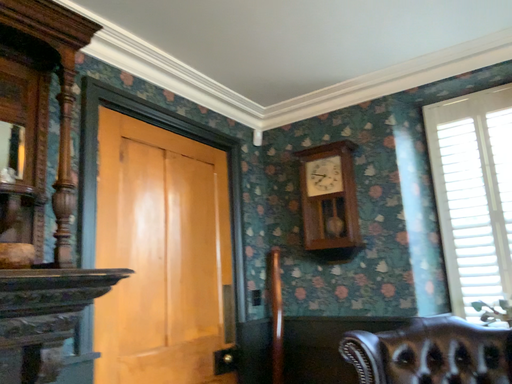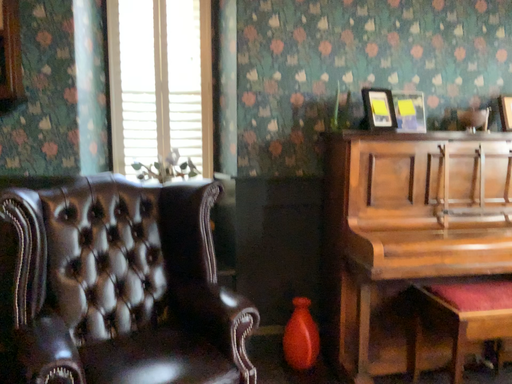
Question: Which way did the camera rotate in the video?

Choices:
 (A) rotated downward
 (B) rotated upward

Answer: (A)